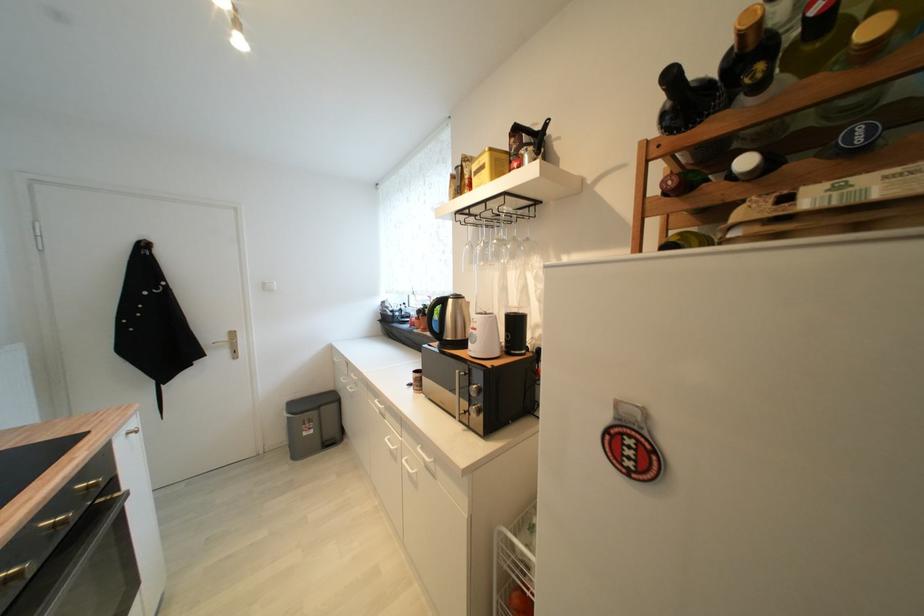
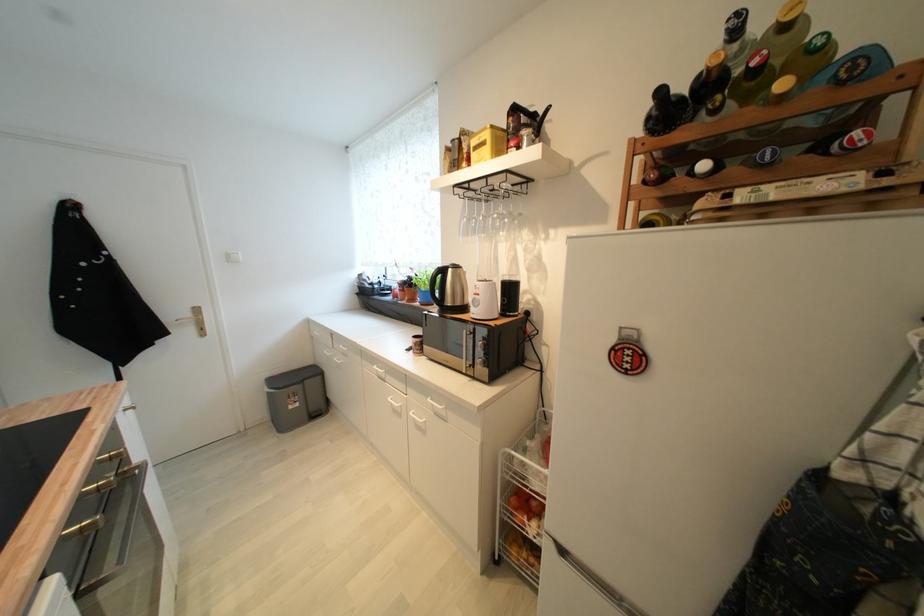
In the second image, find the point that corresponds to point 613,434 in the first image.

(618, 351)